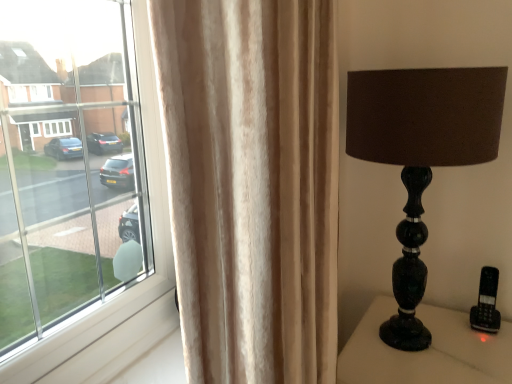
Where is `beige velvet curtain at left`? The width and height of the screenshot is (512, 384). beige velvet curtain at left is located at coordinates (252, 184).

Is shiny black glass lamp at right to the right of black marble lamp at right from the viewer's perspective?

No, shiny black glass lamp at right is not to the right of black marble lamp at right.

In the scene shown: From a real-world perspective, between shiny black glass lamp at right and black marble lamp at right, who is vertically higher?

In real-world perspective, shiny black glass lamp at right is above.

Could you tell me if shiny black glass lamp at right is turned towards black marble lamp at right?

No, shiny black glass lamp at right is not oriented towards black marble lamp at right.

Would you say shiny black glass lamp at right is outside black marble lamp at right?

Absolutely, shiny black glass lamp at right is external to black marble lamp at right.

Is black marble lamp at right oriented away from shiny black glass lamp at right?

No, black marble lamp at right is not facing away from shiny black glass lamp at right.

Can you tell me how much black marble lamp at right and shiny black glass lamp at right differ in facing direction?

There is a 0.0453-degree angle between the facing directions of black marble lamp at right and shiny black glass lamp at right.

Would you consider black marble lamp at right to be distant from shiny black glass lamp at right?

That's not correct — black marble lamp at right is a little close to shiny black glass lamp at right.

Which object is positioned more to the left, black marble lamp at right or shiny black glass lamp at right?

Positioned to the left is shiny black glass lamp at right.

Is beige velvet curtain at left positioned beyond the bounds of shiny black glass lamp at right?

That's correct, beige velvet curtain at left is outside of shiny black glass lamp at right.

Which of these two, beige velvet curtain at left or shiny black glass lamp at right, is wider?

With larger width is shiny black glass lamp at right.

Which of these two, beige velvet curtain at left or shiny black glass lamp at right, is bigger?

Bigger between the two is shiny black glass lamp at right.

Identify the location of curtain in front of the black marble lamp at right. (252, 184).

Would you say beige velvet curtain at left is part of black marble lamp at right's contents?

No, beige velvet curtain at left is not inside black marble lamp at right.

Is black marble lamp at right taller or shorter than beige velvet curtain at left?

black marble lamp at right is shorter than beige velvet curtain at left.

Which object is further away from the camera, black marble lamp at right or beige velvet curtain at left?

black marble lamp at right is further away from the camera.

Considering the sizes of objects shiny black glass lamp at right and beige velvet curtain at left in the image provided, who is smaller, shiny black glass lamp at right or beige velvet curtain at left?

beige velvet curtain at left is smaller.

From the image's perspective, would you say shiny black glass lamp at right is shown under beige velvet curtain at left?

No.

Considering the positions of point (452, 117) and point (221, 118), is point (452, 117) closer or farther from the camera than point (221, 118)?

Point (452, 117) is positioned farther from the camera compared to point (221, 118).

How much distance is there between beige velvet curtain at left and black marble lamp at right?

beige velvet curtain at left is 53.68 centimeters from black marble lamp at right.

Is point (192, 148) positioned behind point (490, 361)?

No.

Does beige velvet curtain at left lie in front of black marble lamp at right?

Yes.

Is black marble lamp at right completely or partially inside beige velvet curtain at left?

No.

Find the location of a particular element. This screenshot has height=384, width=512. lamp in front of the black marble lamp at right is located at coordinates (421, 154).

I want to click on lamp on the left of black marble lamp at right, so click(x=421, y=154).

Considering their positions, is shiny black glass lamp at right positioned further to beige velvet curtain at left than black marble lamp at right?

Among the two, black marble lamp at right is located further to beige velvet curtain at left.

Estimate the real-world distances between objects in this image. Which object is closer to shiny black glass lamp at right, black marble lamp at right or beige velvet curtain at left?

black marble lamp at right is closer to shiny black glass lamp at right.

Looking at the image, which one is located closer to shiny black glass lamp at right, beige velvet curtain at left or black marble lamp at right?

The object closer to shiny black glass lamp at right is black marble lamp at right.

Considering their positions, is black marble lamp at right positioned closer to beige velvet curtain at left than shiny black glass lamp at right?

shiny black glass lamp at right is closer to beige velvet curtain at left.

Considering their positions, is beige velvet curtain at left positioned closer to black marble lamp at right than shiny black glass lamp at right?

The object closer to black marble lamp at right is shiny black glass lamp at right.

Based on the photo, considering their positions, is shiny black glass lamp at right positioned further to black marble lamp at right than beige velvet curtain at left?

beige velvet curtain at left lies further to black marble lamp at right than the other object.

Image resolution: width=512 pixels, height=384 pixels. What are the coordinates of `curtain that lies between shiny black glass lamp at right and black marble lamp at right from top to bottom` in the screenshot? It's located at (252, 184).